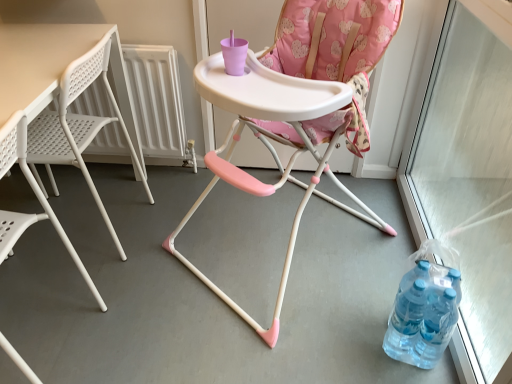
At what (x,y) coordinates should I click in order to perform the action: click on vacant area to the left of translucent plastic bottles at lower right. Please return your answer as a coordinate pair (x, y). This screenshot has width=512, height=384. Looking at the image, I should click on (351, 328).